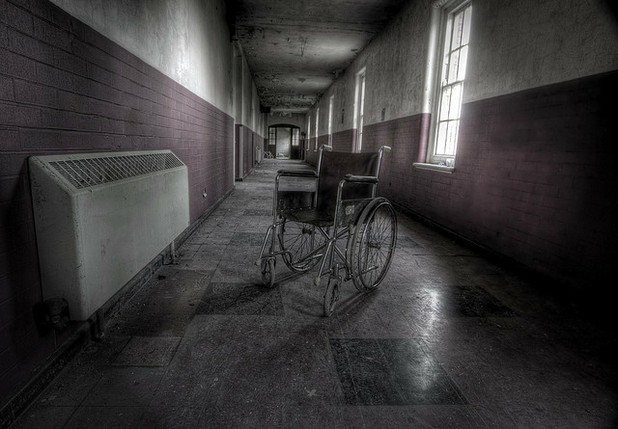
At what (x,y) coordinates should I click in order to perform the action: click on wheelchair handles. Please return your answer as a coordinate pair (x, y). Image resolution: width=618 pixels, height=429 pixels. Looking at the image, I should click on (387, 147), (329, 147).